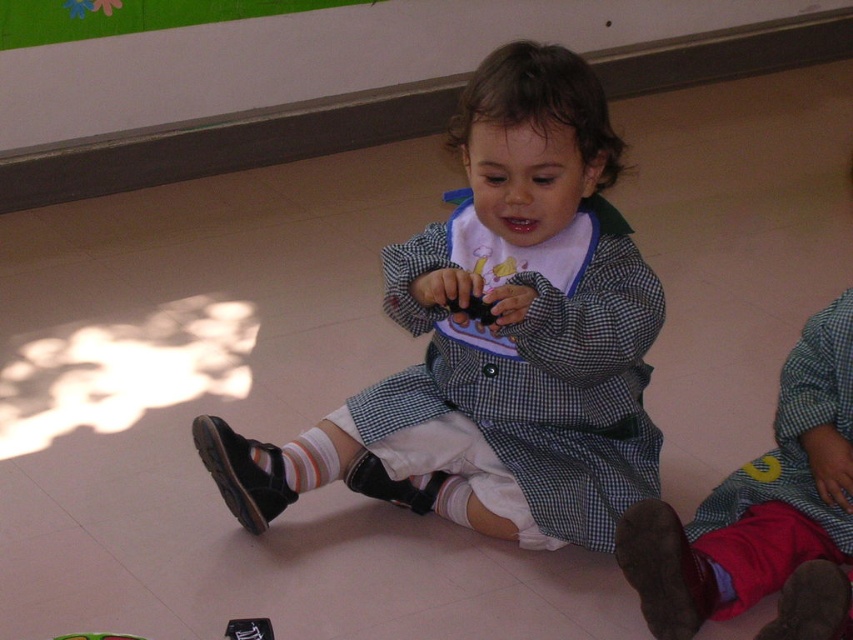
Question: Considering the relative positions of checkered fabric coat at center and red velvet pants at lower right in the image provided, where is checkered fabric coat at center located with respect to red velvet pants at lower right?

Choices:
 (A) below
 (B) above

Answer: (B)

Question: Observing the image, what is the correct spatial positioning of checkered fabric coat at center in reference to red velvet pants at lower right?

Choices:
 (A) above
 (B) below

Answer: (A)

Question: Can you confirm if checkered fabric coat at center is positioned below red velvet pants at lower right?

Choices:
 (A) yes
 (B) no

Answer: (B)

Question: Among these objects, which one is nearest to the camera?

Choices:
 (A) red velvet pants at lower right
 (B) checkered fabric coat at center

Answer: (A)

Question: Among these objects, which one is nearest to the camera?

Choices:
 (A) red velvet pants at lower right
 (B) checkered fabric coat at center

Answer: (A)

Question: Which point is closer to the camera taking this photo?

Choices:
 (A) (619, 244)
 (B) (839, 504)

Answer: (B)